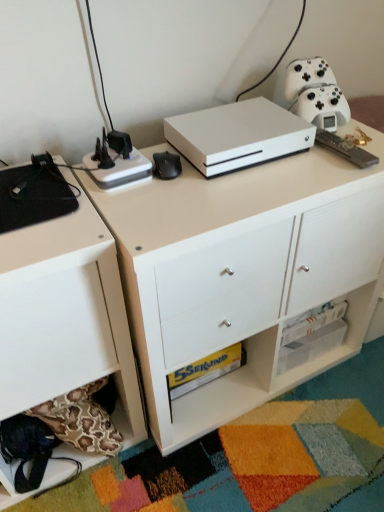
Identify the location of vacant space to the right of white matte gaming console at center, which ranks as the 3th appliance in left-to-right order. This screenshot has width=384, height=512. (335, 158).